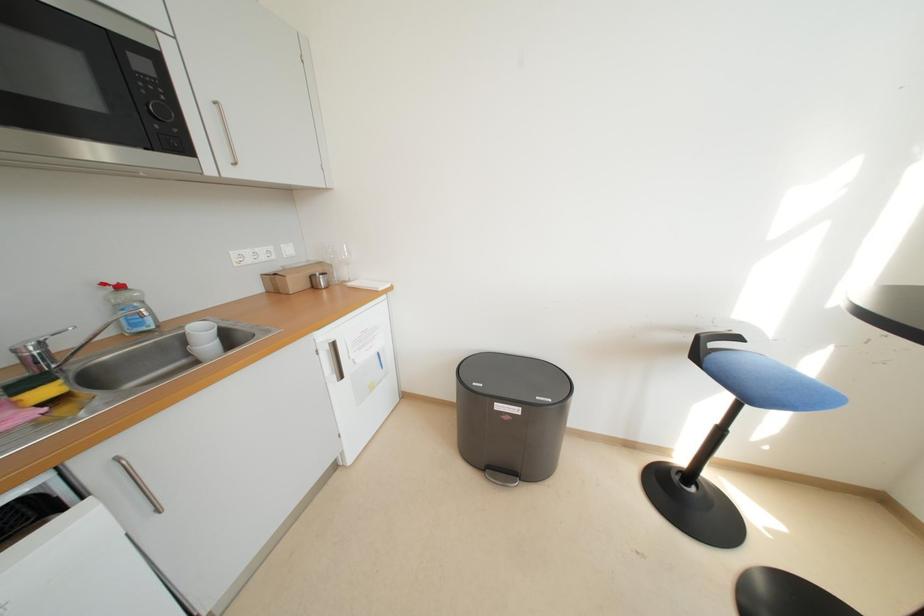
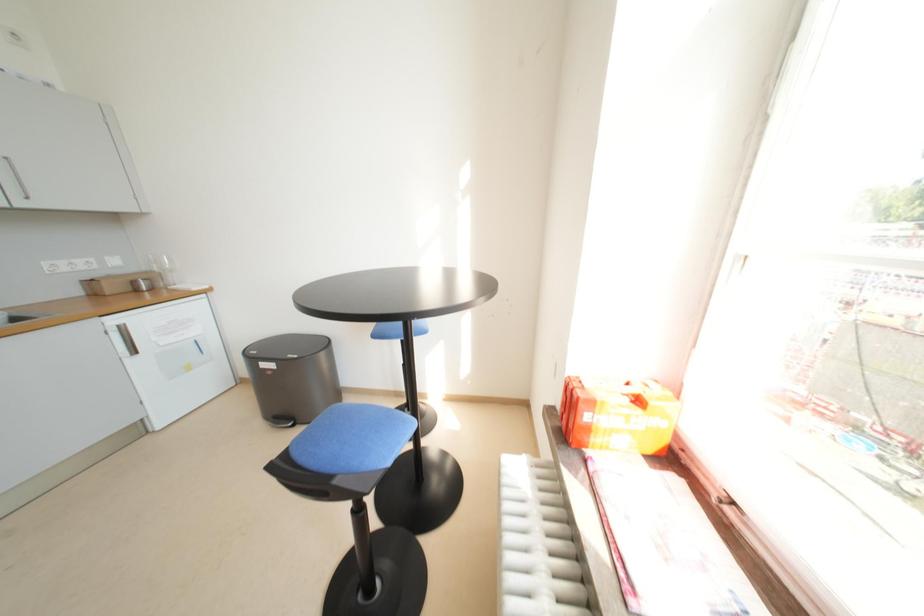
What movement of the cameraman would produce the second image?

The movement direction of the cameraman is right, backward.